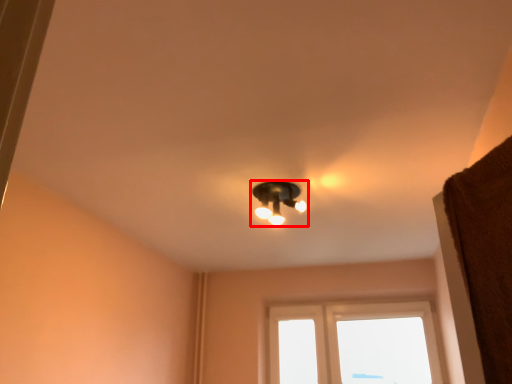
Question: Observing the image, what is the correct spatial positioning of lamp (annotated by the red box) in reference to window?

Choices:
 (A) left
 (B) right

Answer: (A)